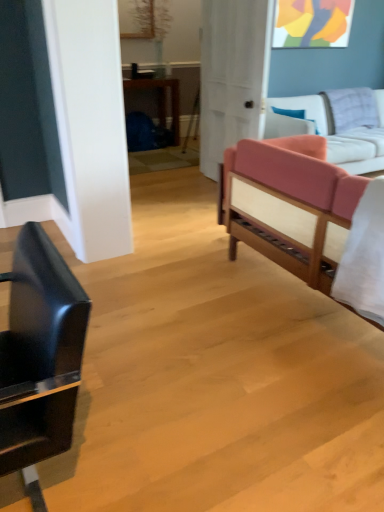
Question: Does point (203, 172) appear closer or farther from the camera than point (299, 98)?

Choices:
 (A) closer
 (B) farther

Answer: (B)

Question: Is white matte door at center taller or shorter than pink fabric studio couch at right, placed as the 2th studio couch when sorted from front to back?

Choices:
 (A) short
 (B) tall

Answer: (B)

Question: Considering the real-world distances, which object is farthest from the white matte door at center?

Choices:
 (A) white cotton sheet at right
 (B) pink fabric studio couch at right, positioned as the first studio couch in back-to-front order
 (C) shiny black chair at left
 (D) pink fabric couch at right, the 1th studio couch when ordered from front to back

Answer: (C)

Question: Which of these objects is positioned farthest from the pink fabric studio couch at right, placed as the 2th studio couch when sorted from front to back?

Choices:
 (A) white cotton sheet at right
 (B) pink fabric couch at right, the second studio couch from the back
 (C) shiny black chair at left
 (D) white matte door at center

Answer: (C)